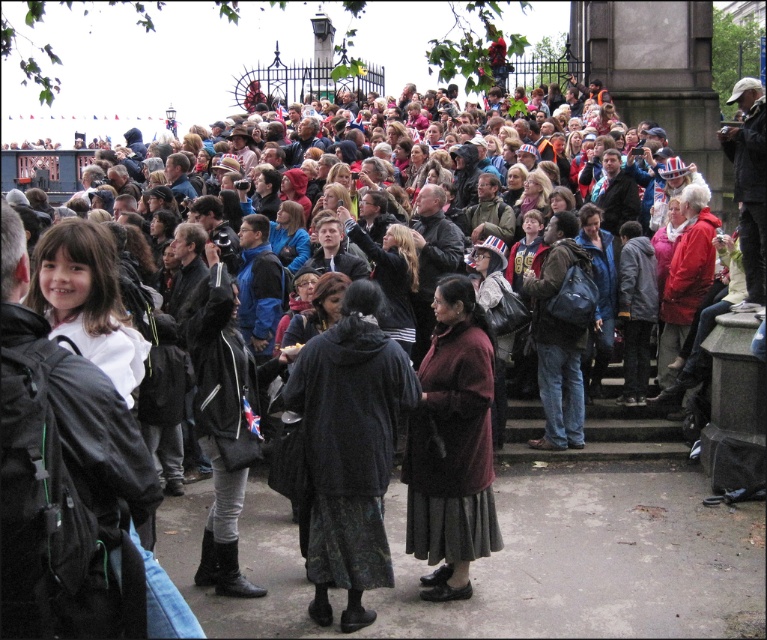
Between dark brown leather jacket at center and matte blue jacket at center, which one has less height?

Standing shorter between the two is matte blue jacket at center.

Is point (367, 253) in front of point (282, 230)?

Yes, point (367, 253) is in front of point (282, 230).

The width and height of the screenshot is (767, 640). In order to click on dark brown leather jacket at center in this screenshot , I will do `click(390, 275)`.

Does point (486, 518) come in front of point (393, 259)?

Yes, point (486, 518) is in front of point (393, 259).

Does maroon wool coat at center lie behind dark brown leather jacket at center?

No, maroon wool coat at center is closer to the viewer.

Image resolution: width=767 pixels, height=640 pixels. Identify the location of maroon wool coat at center. (453, 445).

Does maroon wool coat at center have a lesser height compared to matte blue jacket at center?

No.

Between maroon wool coat at center and matte blue jacket at center, which one appears on the left side from the viewer's perspective?

matte blue jacket at center is more to the left.

Does point (461, 403) come in front of point (275, 250)?

Yes, point (461, 403) is in front of point (275, 250).

Where is `maroon wool coat at center`? The image size is (767, 640). maroon wool coat at center is located at coordinates (453, 445).